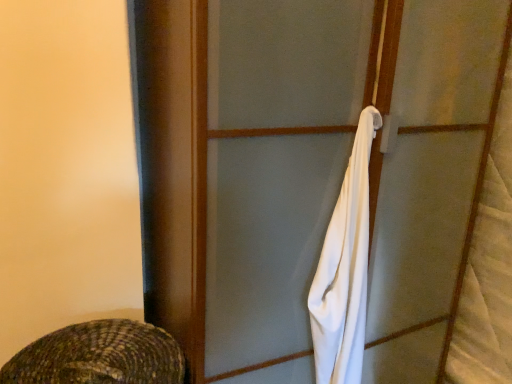
The height and width of the screenshot is (384, 512). Describe the element at coordinates (277, 169) in the screenshot. I see `white fabric at center` at that location.

Find the location of `white fabric at center`. white fabric at center is located at coordinates (277, 169).

What is the approximate width of white cloth at right?

The width of white cloth at right is 6.26 inches.

Describe the element at coordinates (345, 269) in the screenshot. I see `white cloth at right` at that location.

Locate an element on the screen. The width and height of the screenshot is (512, 384). white cloth at right is located at coordinates (345, 269).

Where is `white fabric at center`? This screenshot has height=384, width=512. white fabric at center is located at coordinates (277, 169).

Does white fabric at center appear on the right side of white cloth at right?

No.

Is white fabric at center behind white cloth at right?

No, the depth of white fabric at center is less than that of white cloth at right.

Which is farther from the camera, (328, 208) or (313, 307)?

Positioned behind is point (313, 307).

From the image's perspective, which one is positioned lower, white fabric at center or white cloth at right?

white fabric at center is shown below in the image.

From a real-world perspective, is white fabric at center physically located above or below white cloth at right?

white fabric at center is situated lower than white cloth at right in the real world.

Does white fabric at center have a lesser width compared to white cloth at right?

Incorrect, the width of white fabric at center is not less than that of white cloth at right.

Considering the relative sizes of white fabric at center and white cloth at right in the image provided, is white fabric at center taller than white cloth at right?

Yes, white fabric at center is taller than white cloth at right.

In terms of size, does white fabric at center appear bigger or smaller than white cloth at right?

Clearly, white fabric at center is larger in size than white cloth at right.

Would you say white fabric at center contains white cloth at right?

Yes, white fabric at center is surrounding white cloth at right.

Would you consider white fabric at center to be distant from white cloth at right?

That's not correct — white fabric at center is a little close to white cloth at right.

Is white fabric at center oriented towards white cloth at right?

Yes.

How different are the orientations of white fabric at center and white cloth at right in degrees?

They differ by 10.9 degrees in their facing directions.

Find the location of a particular element. This screenshot has width=512, height=384. screen door below the white cloth at right (from a real-world perspective) is located at coordinates (277, 169).

Considering the positions of objects white cloth at right and white fabric at center in the image provided, who is more to the right, white cloth at right or white fabric at center?

white cloth at right.

Which object is more forward, white cloth at right or white fabric at center?

white fabric at center.

Does point (359, 181) come behind point (293, 298)?

No, (359, 181) is in front of (293, 298).

Looking at this image, from the image's perspective, would you say white cloth at right is shown under white fabric at center?

No.

From a real-world perspective, is white cloth at right over white fabric at center?

Yes, from a real-world perspective, white cloth at right is over white fabric at center

Does white cloth at right have a greater width compared to white fabric at center?

No, white cloth at right is not wider than white fabric at center.

From the picture: Which of these two, white cloth at right or white fabric at center, stands taller?

With more height is white fabric at center.

In the scene shown: Between white cloth at right and white fabric at center, which one has smaller size?

Smaller between the two is white cloth at right.

Could white fabric at center be considered to be inside white cloth at right?

No, white fabric at center is not surrounded by white cloth at right.

Is white cloth at right with white fabric at center?

white cloth at right is not next to white fabric at center, and they're not touching.

Is white cloth at right oriented towards white fabric at center?

Yes, white cloth at right is facing white fabric at center.

How different are the orientations of white cloth at right and white fabric at center in degrees?

10.9 degrees separate the facing orientations of white cloth at right and white fabric at center.

I want to click on screen door in front of the white cloth at right, so coord(277,169).

What are the coordinates of `towel/napkin positioned vertically above the white fabric at center (from a real-world perspective)` in the screenshot? It's located at (345, 269).

Image resolution: width=512 pixels, height=384 pixels. I want to click on screen door on the left of white cloth at right, so click(277, 169).